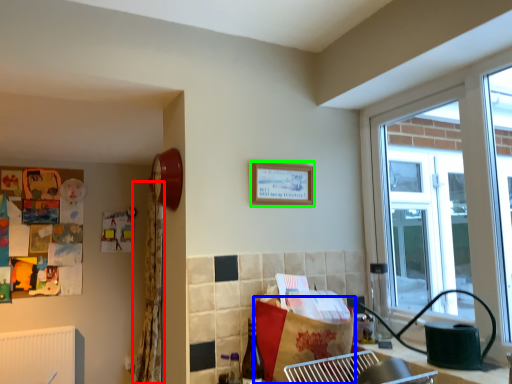
Question: Estimate the real-world distances between objects in this image. Which object is closer to curtain (highlighted by a red box), cardboard box (highlighted by a blue box) or picture frame (highlighted by a green box)?

Choices:
 (A) cardboard box
 (B) picture frame

Answer: (B)